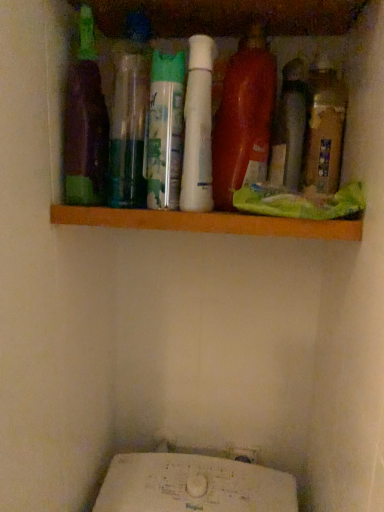
The width and height of the screenshot is (384, 512). Describe the element at coordinates (198, 128) in the screenshot. I see `white matte bottle at center, the fourth bottle from the right` at that location.

Locate an element on the screen. This screenshot has width=384, height=512. white matte bottle at center, arranged as the 4th bottle when viewed from the left is located at coordinates (198, 128).

From the image's perspective, which is below, green matte spray can at center, the fifth bottle in the right-to-left sequence, or matte gray bottle at center-right, marked as the second bottle in a right-to-left arrangement?

green matte spray can at center, the fifth bottle in the right-to-left sequence, appears lower in the image.

Is green matte spray can at center, which ranks as the third bottle in left-to-right order, looking in the opposite direction of matte gray bottle at center-right, marked as the sixth bottle in a left-to-right arrangement?

No, green matte spray can at center, which ranks as the third bottle in left-to-right order, is not facing away from matte gray bottle at center-right, marked as the sixth bottle in a left-to-right arrangement.

Considering their positions, is green matte spray can at center, which ranks as the third bottle in left-to-right order, located in front of or behind matte gray bottle at center-right, marked as the sixth bottle in a left-to-right arrangement?

green matte spray can at center, which ranks as the third bottle in left-to-right order, is in front of matte gray bottle at center-right, marked as the sixth bottle in a left-to-right arrangement.

Based on the photo, between green matte spray can at center, the sixth bottle in the right-to-left sequence, and wooden shelf at upper center, which one has larger size?

With larger size is wooden shelf at upper center.

Is green matte spray can at center, positioned as the 2th bottle in left-to-right order, directly adjacent to wooden shelf at upper center?

No, green matte spray can at center, positioned as the 2th bottle in left-to-right order, is not next to wooden shelf at upper center.

In the image, is green matte spray can at center, the sixth bottle in the right-to-left sequence, on the left side or the right side of wooden shelf at upper center?

green matte spray can at center, the sixth bottle in the right-to-left sequence, is positioned on wooden shelf at upper center's left side.

Is green matte spray can at center, the sixth bottle in the right-to-left sequence, facing towards wooden shelf at upper center?

No, green matte spray can at center, the sixth bottle in the right-to-left sequence, is not oriented towards wooden shelf at upper center.

The height and width of the screenshot is (512, 384). In order to click on bottle that is the 1st object located above the wooden shelf at upper center (from the image's perspective) in this screenshot , I will do point(198,128).

Considering the relative positions of wooden shelf at upper center and white matte bottle at center, the fourth bottle from the right, in the image provided, is wooden shelf at upper center to the right of white matte bottle at center, the fourth bottle from the right, from the viewer's perspective?

Yes.

Is wooden shelf at upper center beside white matte bottle at center, arranged as the 4th bottle when viewed from the left?

wooden shelf at upper center is not next to white matte bottle at center, arranged as the 4th bottle when viewed from the left, and they're not touching.

Is green matte spray can at center, the fifth bottle in the right-to-left sequence, looking in the opposite direction of purple matte bottle at left, the 1th bottle when ordered from left to right?

green matte spray can at center, the fifth bottle in the right-to-left sequence, does not have its back to purple matte bottle at left, the 1th bottle when ordered from left to right.

Between green matte spray can at center, the fifth bottle in the right-to-left sequence, and purple matte bottle at left, which is the seventh bottle from right to left, which one has more height?

Standing taller between the two is purple matte bottle at left, which is the seventh bottle from right to left.

Is green matte spray can at center, which ranks as the third bottle in left-to-right order, surrounding purple matte bottle at left, which is the seventh bottle from right to left?

That's incorrect, purple matte bottle at left, which is the seventh bottle from right to left, is not inside green matte spray can at center, which ranks as the third bottle in left-to-right order.

Between green matte spray can at center, which ranks as the third bottle in left-to-right order, and purple matte bottle at left, the 1th bottle when ordered from left to right, which one has larger width?

Wider between the two is green matte spray can at center, which ranks as the third bottle in left-to-right order.

Is white matte bottle at center, the fourth bottle from the right, facing towards matte gray bottle at center-right, marked as the second bottle in a right-to-left arrangement?

No, white matte bottle at center, the fourth bottle from the right, is not aimed at matte gray bottle at center-right, marked as the second bottle in a right-to-left arrangement.

Does point (188, 156) appear closer or farther from the camera than point (276, 135)?

Point (188, 156) is closer to the camera than point (276, 135).

Considering the relative positions of white matte bottle at center, the fourth bottle from the right, and matte gray bottle at center-right, marked as the second bottle in a right-to-left arrangement, in the image provided, is white matte bottle at center, the fourth bottle from the right, to the left of matte gray bottle at center-right, marked as the second bottle in a right-to-left arrangement, from the viewer's perspective?

Indeed, white matte bottle at center, the fourth bottle from the right, is positioned on the left side of matte gray bottle at center-right, marked as the second bottle in a right-to-left arrangement.

From the image's perspective, relative to white matte bottle at center, the fourth bottle from the right, is green matte spray can at center, which ranks as the third bottle in left-to-right order, above or below?

Clearly, from the image's perspective, green matte spray can at center, which ranks as the third bottle in left-to-right order, is above white matte bottle at center, the fourth bottle from the right.

Is white matte bottle at center, arranged as the 4th bottle when viewed from the left, at the back of green matte spray can at center, which ranks as the third bottle in left-to-right order?

That's not correct — green matte spray can at center, which ranks as the third bottle in left-to-right order, is not looking away from white matte bottle at center, arranged as the 4th bottle when viewed from the left.

Is green matte spray can at center, which ranks as the third bottle in left-to-right order, surrounding white matte bottle at center, arranged as the 4th bottle when viewed from the left?

No, green matte spray can at center, which ranks as the third bottle in left-to-right order, does not contain white matte bottle at center, arranged as the 4th bottle when viewed from the left.

Between green matte spray can at center, which ranks as the third bottle in left-to-right order, and white matte bottle at center, arranged as the 4th bottle when viewed from the left, which one has smaller width?

green matte spray can at center, which ranks as the third bottle in left-to-right order, is thinner.

Is brown matte bottle at right, which ranks as the 7th bottle in left-to-right order, positioned beyond the bounds of matte gray bottle at center-right, marked as the sixth bottle in a left-to-right arrangement?

Absolutely, brown matte bottle at right, which ranks as the 7th bottle in left-to-right order, is external to matte gray bottle at center-right, marked as the sixth bottle in a left-to-right arrangement.

Considering their positions, is brown matte bottle at right, which ranks as the 7th bottle in left-to-right order, located in front of or behind matte gray bottle at center-right, marked as the second bottle in a right-to-left arrangement?

In the image, brown matte bottle at right, which ranks as the 7th bottle in left-to-right order, appears in front of matte gray bottle at center-right, marked as the second bottle in a right-to-left arrangement.

From a real-world perspective, which object rests below the other?

From a 3D spatial view, matte gray bottle at center-right, marked as the sixth bottle in a left-to-right arrangement, is below.

This screenshot has height=512, width=384. I want to click on the 1st bottle below the matte gray bottle at center-right, marked as the sixth bottle in a left-to-right arrangement (from the image's perspective), so click(165, 130).

This screenshot has width=384, height=512. In order to click on the 7th bottle located above the wooden shelf at upper center (from a real-world perspective) in this screenshot , I will do `click(129, 114)`.

Considering their positions, is brown matte bottle at right, which ranks as the 7th bottle in left-to-right order, positioned further to green matte spray can at center, positioned as the 2th bottle in left-to-right order, than matte gray bottle at center-right, marked as the second bottle in a right-to-left arrangement?

The object further to green matte spray can at center, positioned as the 2th bottle in left-to-right order, is brown matte bottle at right, which ranks as the 7th bottle in left-to-right order.

From the image, which object appears to be farther from green matte spray can at center, which ranks as the third bottle in left-to-right order, white matte bottle at center, arranged as the 4th bottle when viewed from the left, or purple matte bottle at left, which is the seventh bottle from right to left?

purple matte bottle at left, which is the seventh bottle from right to left, is positioned further to the anchor green matte spray can at center, which ranks as the third bottle in left-to-right order.

Estimate the real-world distances between objects in this image. Which object is further from green matte spray can at center, the fifth bottle in the right-to-left sequence, green matte spray can at center, the sixth bottle in the right-to-left sequence, or matte gray bottle at center-right, marked as the second bottle in a right-to-left arrangement?

The object further to green matte spray can at center, the fifth bottle in the right-to-left sequence, is matte gray bottle at center-right, marked as the second bottle in a right-to-left arrangement.

From the image, which object appears to be nearer to white matte bottle at center, the fourth bottle from the right, green matte spray can at center, positioned as the 2th bottle in left-to-right order, or green matte spray can at center, which ranks as the third bottle in left-to-right order?

green matte spray can at center, which ranks as the third bottle in left-to-right order.

Based on their spatial positions, is green matte spray can at center, which ranks as the third bottle in left-to-right order, or wooden shelf at upper center further from matte gray bottle at center-right, marked as the second bottle in a right-to-left arrangement?

The object further to matte gray bottle at center-right, marked as the second bottle in a right-to-left arrangement, is wooden shelf at upper center.

Estimate the real-world distances between objects in this image. Which object is closer to white matte bottle at center, the fourth bottle from the right, brown matte bottle at right, which is counted as the 1th bottle, starting from the right, or shiny orange bottle at center, the 3th bottle viewed from the right?

Based on the image, shiny orange bottle at center, the 3th bottle viewed from the right, appears to be nearer to white matte bottle at center, the fourth bottle from the right.

Which object lies nearer to the anchor point brown matte bottle at right, which ranks as the 7th bottle in left-to-right order, matte gray bottle at center-right, marked as the second bottle in a right-to-left arrangement, or green matte spray can at center, positioned as the 2th bottle in left-to-right order?

matte gray bottle at center-right, marked as the second bottle in a right-to-left arrangement, is positioned closer to the anchor brown matte bottle at right, which ranks as the 7th bottle in left-to-right order.

From the image, which object appears to be nearer to white matte bottle at center, arranged as the 4th bottle when viewed from the left, brown matte bottle at right, which ranks as the 7th bottle in left-to-right order, or wooden shelf at upper center?

→ wooden shelf at upper center is closer to white matte bottle at center, arranged as the 4th bottle when viewed from the left.

You are a GUI agent. You are given a task and a screenshot of the screen. Output one action in this format:
    pyautogui.click(x=<x>, y=<y>)
    Task: Click on the bottle between green matte spray can at center, the fifth bottle in the right-to-left sequence, and wooden shelf at upper center vertically
    The image size is (384, 512).
    Given the screenshot: What is the action you would take?
    pyautogui.click(x=198, y=128)

You are a GUI agent. You are given a task and a screenshot of the screen. Output one action in this format:
    pyautogui.click(x=<x>, y=<y>)
    Task: Click on the bottle located between green matte spray can at center, the sixth bottle in the right-to-left sequence, and white matte bottle at center, arranged as the 4th bottle when viewed from the left, in the left-right direction
    This screenshot has width=384, height=512.
    Given the screenshot: What is the action you would take?
    pyautogui.click(x=165, y=130)

Image resolution: width=384 pixels, height=512 pixels. In order to click on ledge situated between purple matte bottle at left, the 1th bottle when ordered from left to right, and shiny orange bottle at center, which is the fifth bottle from left to right, from left to right in this screenshot , I will do `click(207, 222)`.

Identify the location of bottle between green matte spray can at center, the fifth bottle in the right-to-left sequence, and shiny orange bottle at center, the 3th bottle viewed from the right, in the horizontal direction. Image resolution: width=384 pixels, height=512 pixels. pos(198,128).